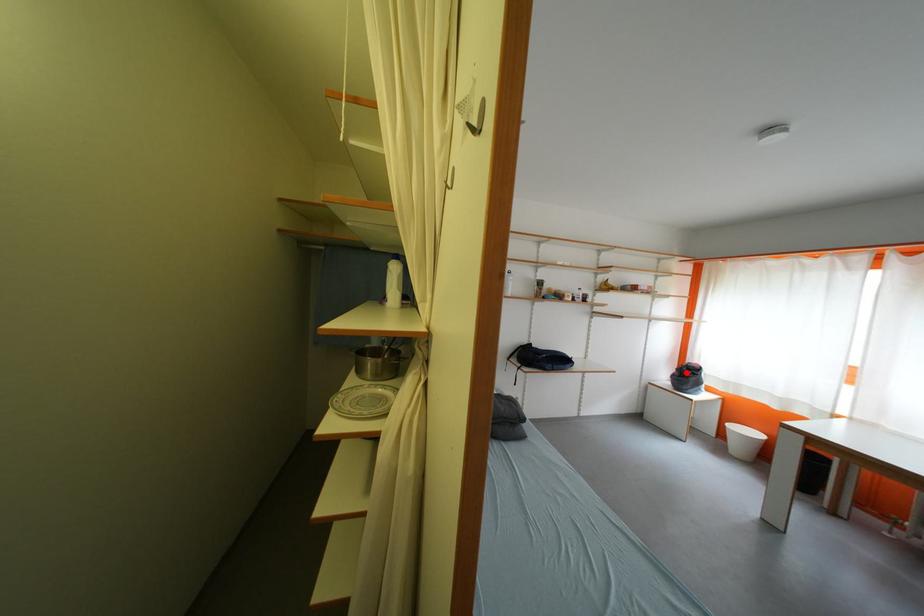
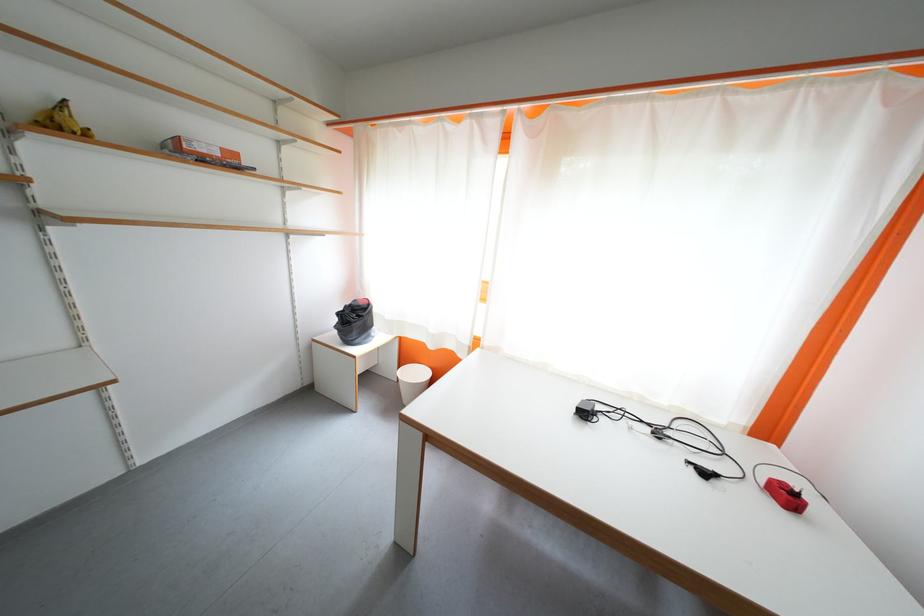
Question: A red point is marked in image1. In image2, is the corresponding 3D point closer to the camera or farther? Reply with the corresponding letter.

Choices:
 (A) The corresponding 3D point is closer.
 (B) The corresponding 3D point is farther.

Answer: (B)